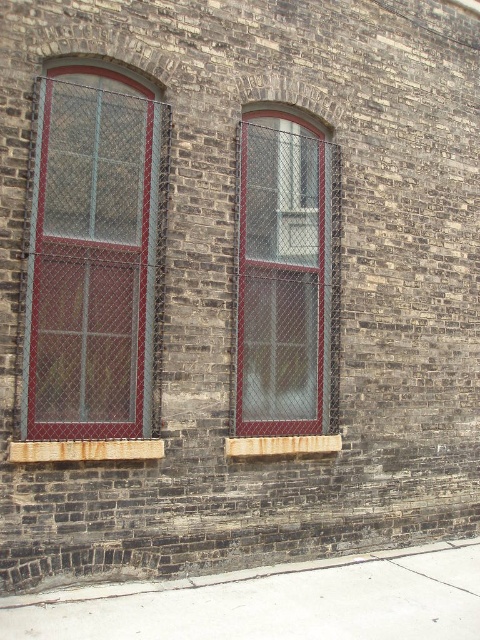
You are a delivery person trying to reach the gray concrete pavement at lower center from the matte glass window at left. The delivery cart you are using has a minimum turning radius of 8 feet. Can you navigate to the pavement without moving the chain link fence blocking the windows?

The distance between the matte glass window at left and the gray concrete pavement at lower center is 8.48 feet, which is greater than the cart minimum turning radius of 8 feet. Therefore, the delivery person can navigate to the gray concrete pavement at lower center without needing to move the chain link fence.

You are standing in front of a brick wall with two arched windows framed in red. You notice two points marked on the wall. One is at coordinate point (476, 620) and the other at point (304, 316). Which point is closer to you?

Point (476, 620) is in front of point (304, 316), so the point at (476, 620) is closer to you.